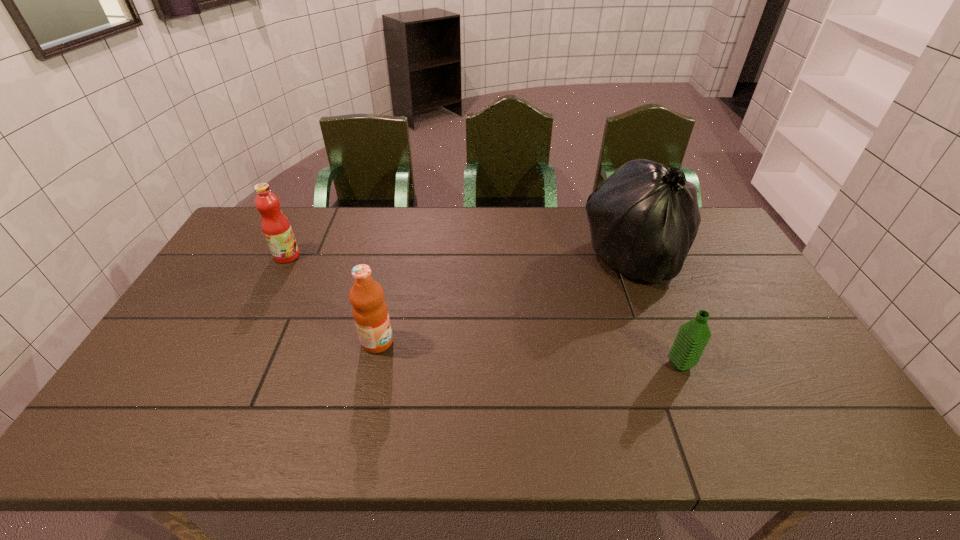
Find the location of a particular element. The height and width of the screenshot is (540, 960). plastic bag is located at coordinates (644, 218).

This screenshot has height=540, width=960. I want to click on the farther fruit juice, so click(276, 228).

Find the location of a particular element. This screenshot has height=540, width=960. the left fruit juice is located at coordinates (276, 228).

You are a GUI agent. You are given a task and a screenshot of the screen. Output one action in this format:
    pyautogui.click(x=<x>, y=<y>)
    Task: Click on the right fruit juice
    The image size is (960, 540).
    Given the screenshot: What is the action you would take?
    pyautogui.click(x=370, y=312)

What are the coordinates of `the nearer fruit juice` in the screenshot? It's located at (370, 312).

This screenshot has height=540, width=960. I want to click on the shortest object, so click(x=692, y=338).

Find the location of a particular element. The image size is (960, 540). vacant region located 0.280m on the front of the plastic bag is located at coordinates (680, 371).

Where is `free space located 0.220m on the front label of the leftmost object`? The image size is (960, 540). free space located 0.220m on the front label of the leftmost object is located at coordinates (366, 256).

Identify the location of free location located 0.220m on the front label of the nearer fruit juice. Image resolution: width=960 pixels, height=540 pixels. [475, 342].

Image resolution: width=960 pixels, height=540 pixels. I want to click on free region located on the back of the water bottle, so click(x=659, y=313).